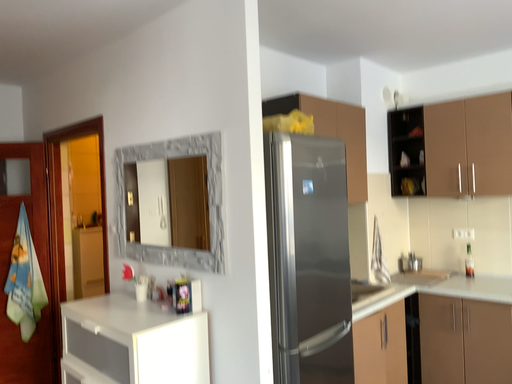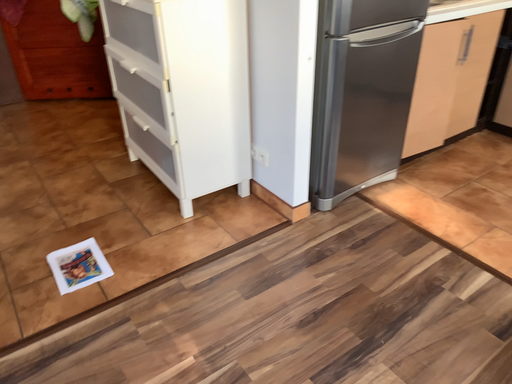
Question: Which way did the camera rotate in the video?

Choices:
 (A) rotated upward
 (B) rotated downward

Answer: (B)